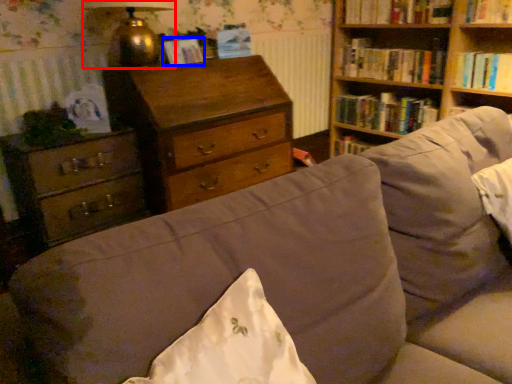
Question: Which point is closer to the camera, lamp (highlighted by a red box) or paperback book (highlighted by a blue box)?

Choices:
 (A) lamp
 (B) paperback book

Answer: (A)